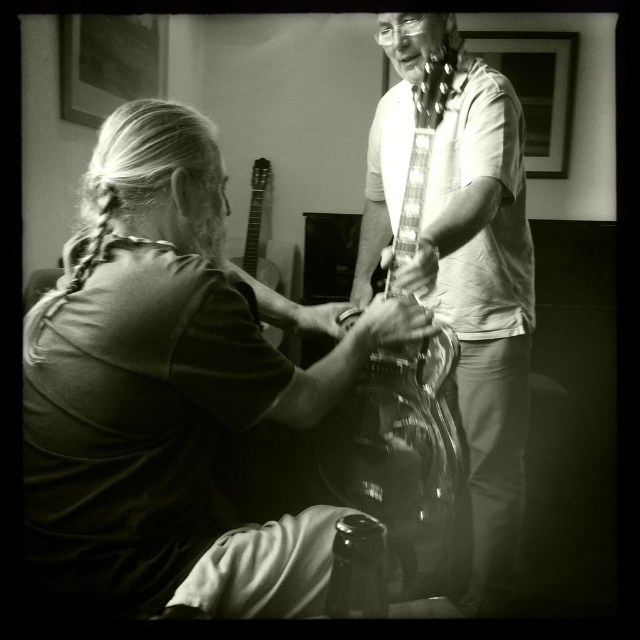
Question: Is smooth leather guitar at center to the right of glossy wood guitar at center from the viewer's perspective?

Choices:
 (A) no
 (B) yes

Answer: (A)

Question: Which point appears closest to the camera in this image?

Choices:
 (A) (506, 216)
 (B) (220, 396)

Answer: (B)

Question: Can you confirm if glossy wood guitar at center is positioned below acoustic wood guitar at upper center?

Choices:
 (A) yes
 (B) no

Answer: (A)

Question: Where is translucent glass bottle at lower center located in relation to acoustic wood guitar at upper center in the image?

Choices:
 (A) above
 (B) below

Answer: (B)

Question: Which object appears closest to the camera in this image?

Choices:
 (A) smooth leather guitar at center
 (B) glossy wood guitar at center

Answer: (A)

Question: Among these points, which one is nearest to the camera?

Choices:
 (A) (77, 241)
 (B) (333, 573)
 (C) (257, 180)
 (D) (502, 132)

Answer: (B)